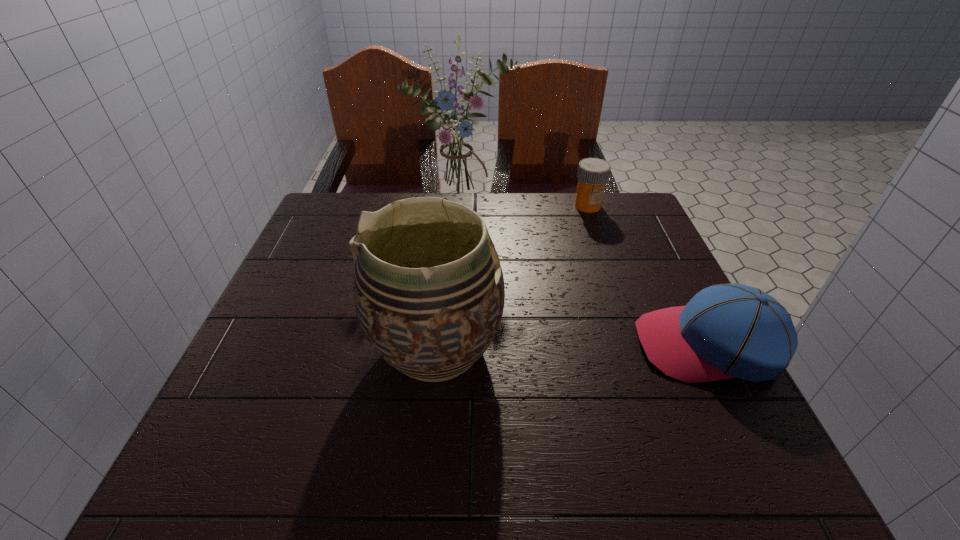
Locate an element on the screen. Image resolution: width=960 pixels, height=540 pixels. vacant space situated on the front-facing side of the tallest object is located at coordinates (519, 267).

Where is `free space located on the label side of the medicine`? free space located on the label side of the medicine is located at coordinates (602, 298).

Identify the location of vacant space situated 0.280m on the label side of the medicine. (599, 280).

Where is `vacant position located on the label side of the medicine`? This screenshot has height=540, width=960. vacant position located on the label side of the medicine is located at coordinates (598, 277).

This screenshot has width=960, height=540. Find the location of `bouquet situated at the far edge`. bouquet situated at the far edge is located at coordinates (458, 173).

Image resolution: width=960 pixels, height=540 pixels. I want to click on medicine located in the far edge section of the desktop, so click(x=593, y=173).

Locate an element on the screen. pottery that is at the near edge is located at coordinates (429, 294).

The image size is (960, 540). I want to click on baseball cap that is at the near edge, so click(x=725, y=331).

At what (x,y) coordinates should I click in order to perform the action: click on baseball cap positioned at the right edge. Please return your answer as a coordinate pair (x, y). This screenshot has height=540, width=960. Looking at the image, I should click on (725, 331).

Identify the location of medicine that is at the right edge. (593, 173).